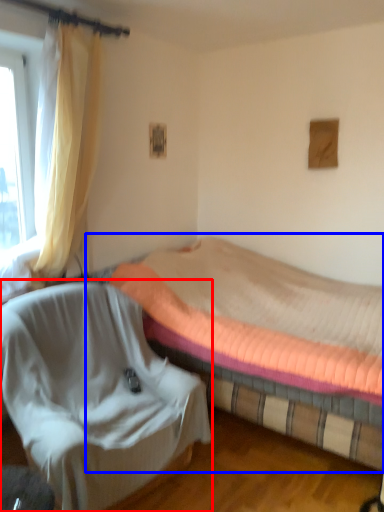
Question: Which point is closer to the camera, chair (highlighted by a red box) or bed (highlighted by a blue box)?

Choices:
 (A) chair
 (B) bed

Answer: (A)